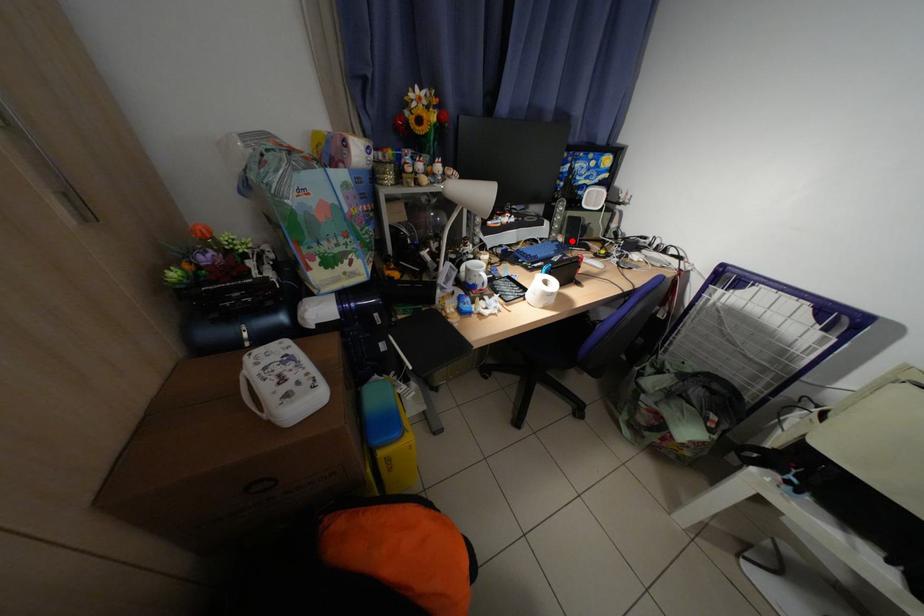
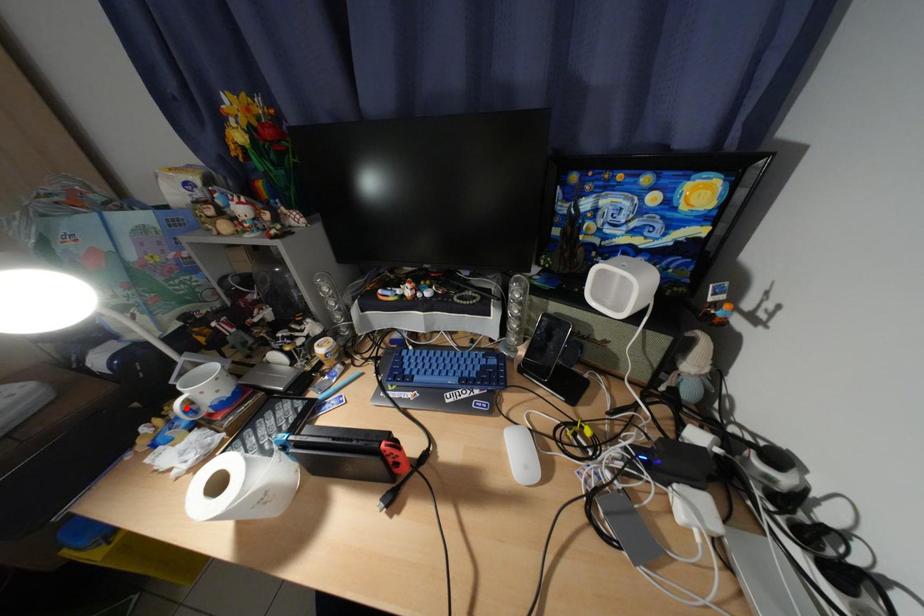
I am providing you with two images of the same scene from different viewpoints. A red point is marked on the first image and another point is marked on the second image. Is the marked point in image1 the same physical position as the marked point in image2?

No